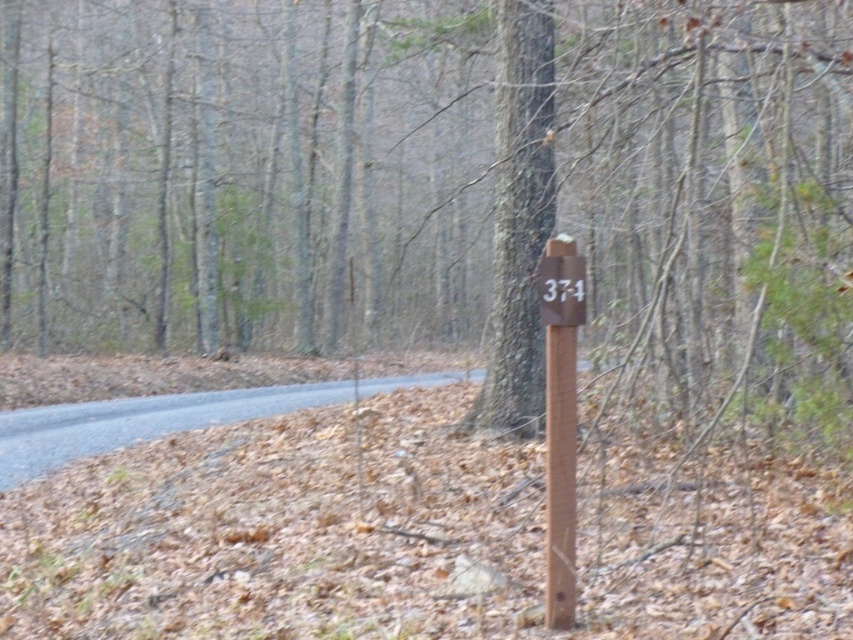
You are a hiker who wants to read the number on the sign. Which object should you look at, the brown wood signpost at center or the brown wooden post at center?

The brown wood signpost at center has a greater height compared to the brown wooden post at center, so you should look at the brown wood signpost at center to read the number.

You are hiking in the woods and see the brown wood signpost at center and the brown wooden post at center. Which one is positioned to the left?

The brown wood signpost at center is positioned to the left of the brown wooden post at center.

You are standing on the gray asphalt road at lower left and want to see the brown wooden post at center. Which direction should you look to see the post?

The brown wooden post at center is taller than the gray asphalt road at lower left, so you should look upward to see the brown wooden post at center.